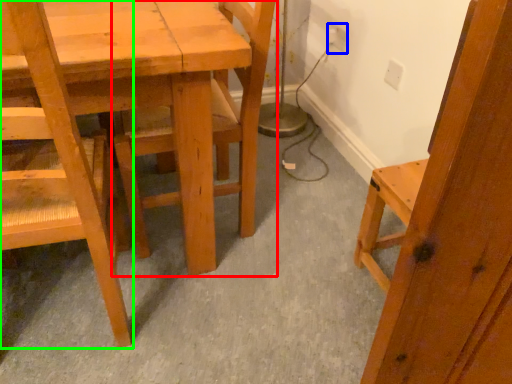
Question: Considering the real-world distances, which object is farthest from chair (highlighted by a red box)? electric outlet (highlighted by a blue box) or chair (highlighted by a green box)?

Choices:
 (A) electric outlet
 (B) chair

Answer: (A)